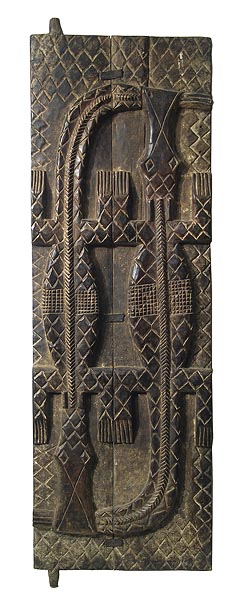
Where is `faded door`? faded door is located at coordinates (132, 481).